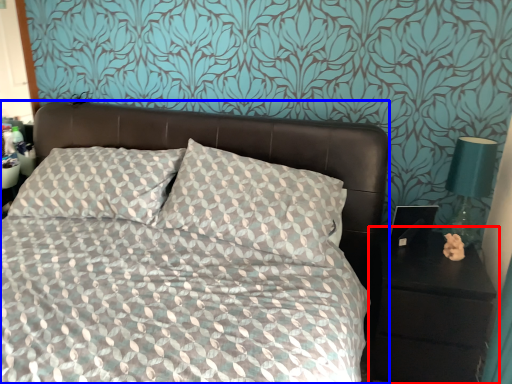
Question: Which object appears closest to the camera in this image, nightstand (highlighted by a red box) or bed (highlighted by a blue box)?

Choices:
 (A) nightstand
 (B) bed

Answer: (B)